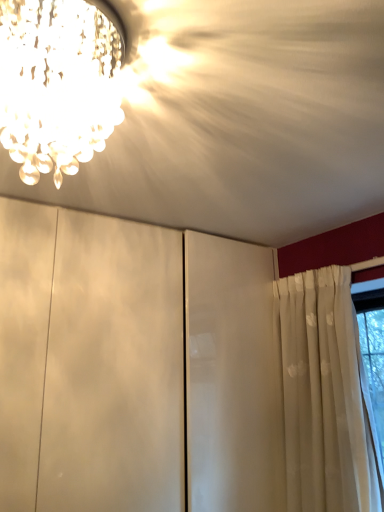
Question: Does white matte cabinet at center have a smaller size compared to crystal chandelier at upper left?

Choices:
 (A) no
 (B) yes

Answer: (A)

Question: From the image's perspective, is white matte cabinet at center located above crystal chandelier at upper left?

Choices:
 (A) no
 (B) yes

Answer: (A)

Question: Is white matte cabinet at center next to crystal chandelier at upper left?

Choices:
 (A) no
 (B) yes

Answer: (A)

Question: Can you confirm if white matte cabinet at center is wider than crystal chandelier at upper left?

Choices:
 (A) yes
 (B) no

Answer: (A)

Question: From a real-world perspective, is white matte cabinet at center under crystal chandelier at upper left?

Choices:
 (A) no
 (B) yes

Answer: (A)

Question: Is white matte cabinet at center bigger than crystal chandelier at upper left?

Choices:
 (A) yes
 (B) no

Answer: (A)

Question: Is white matte cabinet at center at the back of crystal chandelier at upper left?

Choices:
 (A) no
 (B) yes

Answer: (A)

Question: Considering the relative sizes of crystal chandelier at upper left and white matte cabinet at center in the image provided, is crystal chandelier at upper left shorter than white matte cabinet at center?

Choices:
 (A) yes
 (B) no

Answer: (B)

Question: From the image's perspective, is crystal chandelier at upper left under white matte cabinet at center?

Choices:
 (A) yes
 (B) no

Answer: (B)

Question: From the image's perspective, is crystal chandelier at upper left over white matte cabinet at center?

Choices:
 (A) yes
 (B) no

Answer: (A)

Question: Considering the relative sizes of crystal chandelier at upper left and white matte cabinet at center in the image provided, is crystal chandelier at upper left taller than white matte cabinet at center?

Choices:
 (A) no
 (B) yes

Answer: (B)

Question: Does crystal chandelier at upper left lie behind white matte cabinet at center?

Choices:
 (A) yes
 (B) no

Answer: (A)

Question: Considering the positions of crystal chandelier at upper left and white matte cabinet at center in the image, is crystal chandelier at upper left bigger or smaller than white matte cabinet at center?

Choices:
 (A) big
 (B) small

Answer: (B)